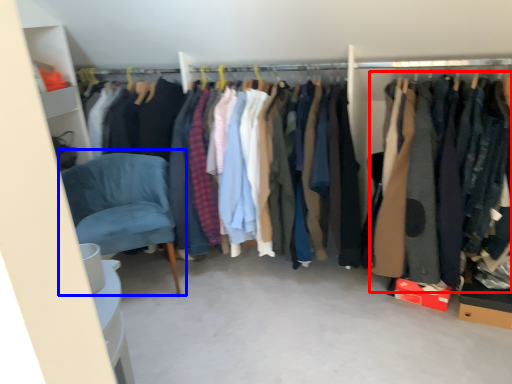
Question: Which of the following is the farthest to the observer, clothing (highlighted by a red box) or chair (highlighted by a blue box)?

Choices:
 (A) clothing
 (B) chair

Answer: (B)